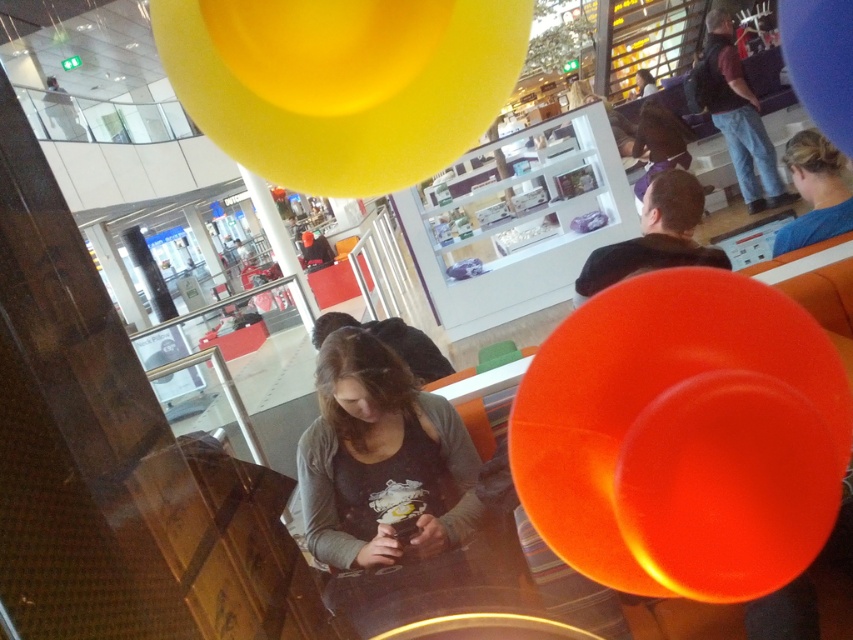
You are a photographer trying to capture both the yellow matte balloon at upper center and the blue rubber balloon at upper right in a single frame. Given their sizes, which balloon will appear larger in your photo?

The yellow matte balloon at upper center will appear larger in the photo because it is bigger than the blue rubber balloon at upper right.

You are a photographer trying to capture both the yellow matte balloon at upper center and the blue rubber balloon at upper right in a single frame. Given their sizes, which balloon should you position closer to the camera to ensure both appear similarly sized in the photo?

The blue rubber balloon at upper right should be positioned closer to the camera because it is smaller in width than the yellow matte balloon at upper center. By moving the smaller balloon closer, you can balance their apparent sizes in the photograph.